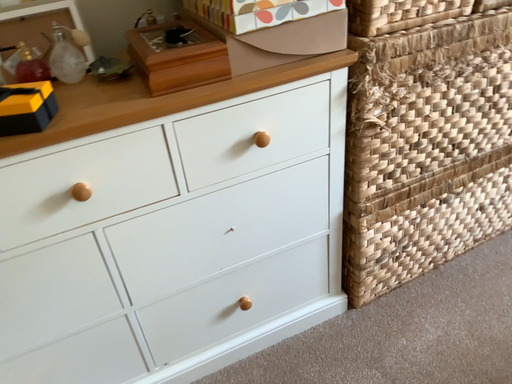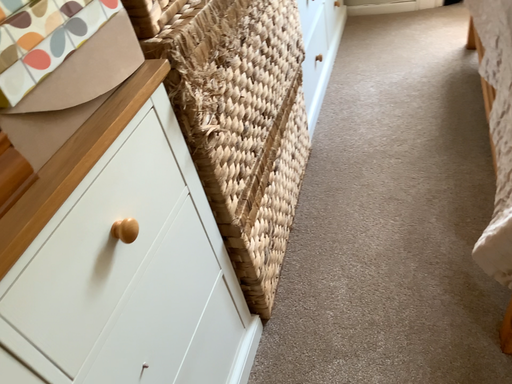
Question: How did the camera likely rotate when shooting the video?

Choices:
 (A) rotated left
 (B) rotated right

Answer: (B)